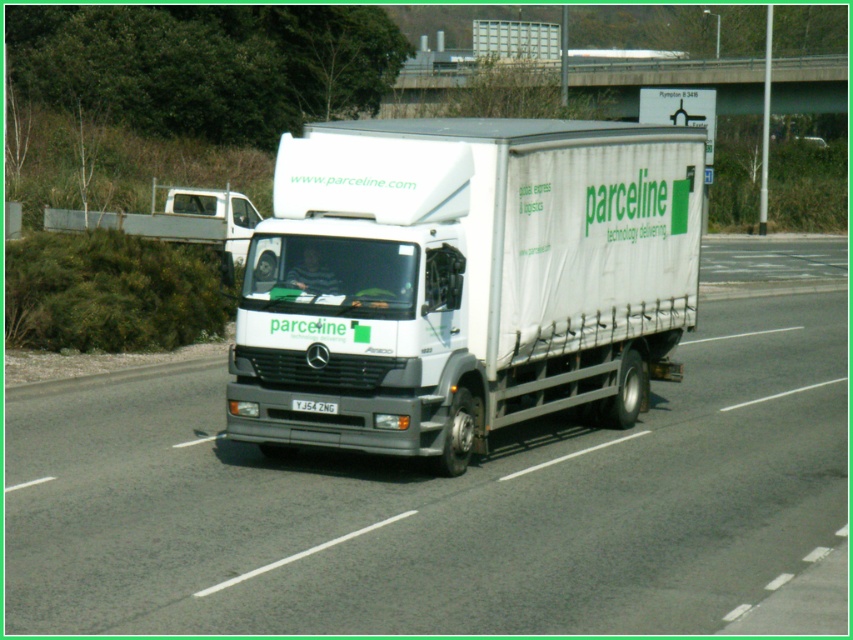
You are a pedestrian standing on the sidewalk and see the white matte truck at center and the white plastic license plate at center. Which one is more to the right?

The white matte truck at center is positioned on the right side of the white plastic license plate at center, so the white matte truck at center is more to the right.

You are standing on the side of the road watching the white Mercedes truck with parceline written on its side. There are two points marked on the truck. Which point is closer to you, point at coordinate (432,588) or point at coordinate (401,284)?

Point at coordinate (432,588) is closer to you than point at coordinate (401,284).